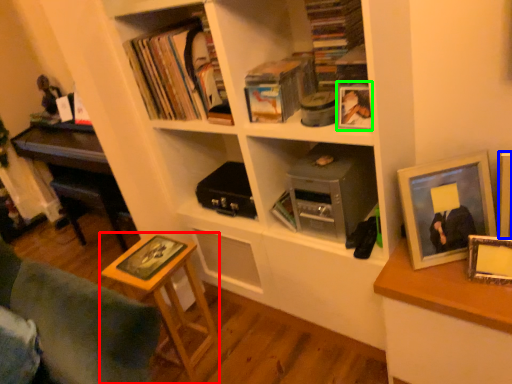
Question: Which is nearer to the table (highlighted by a red box)? picture frame (highlighted by a blue box) or picture frame (highlighted by a green box).

Choices:
 (A) picture frame
 (B) picture frame

Answer: (B)